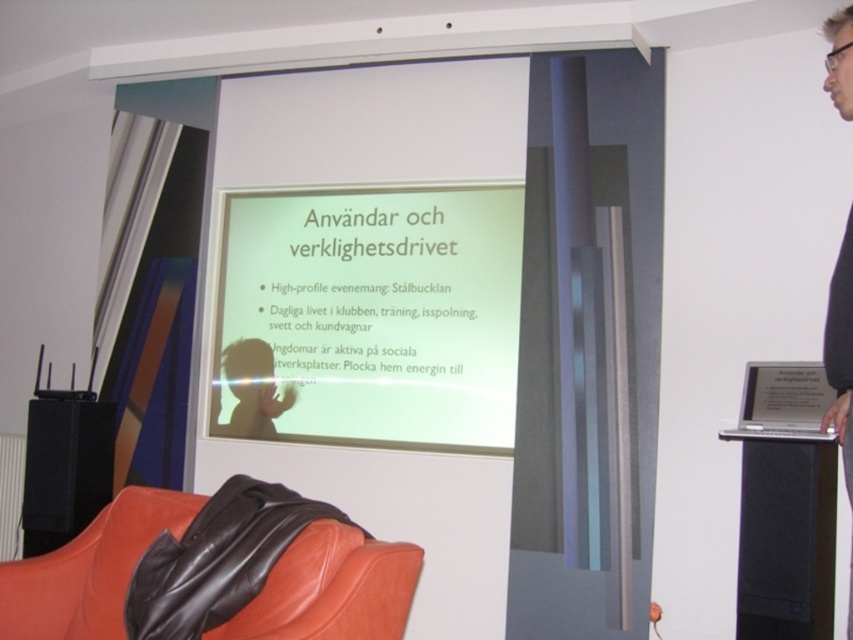
You are an attendee sitting in the conference room and you see the white matte projector screen at center and the black fabric at upper right. Which object is located to the left of the other?

The white matte projector screen at center is located to the left of black fabric at upper right.

You are setting up a new projector in the conference room and need to ensure it can cover both the white matte projector screen at center and the black fabric at upper right. Given the screen is much taller than the fabric, will the projector need to be adjusted to accommodate the height difference?

The white matte projector screen at center is much taller than the black fabric at upper right, so the projector will need to be adjusted to ensure it covers the entire height of the taller screen while also projecting onto the fabric.